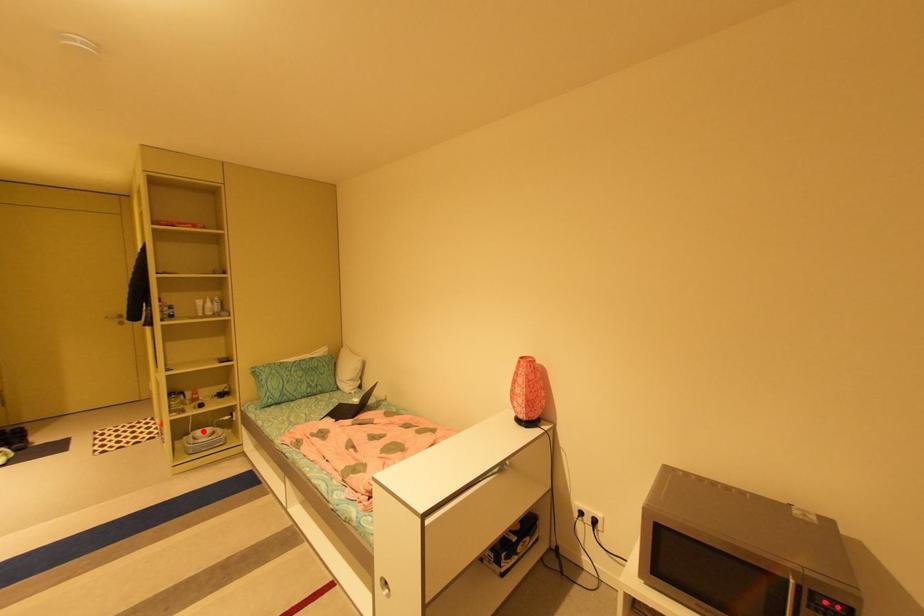
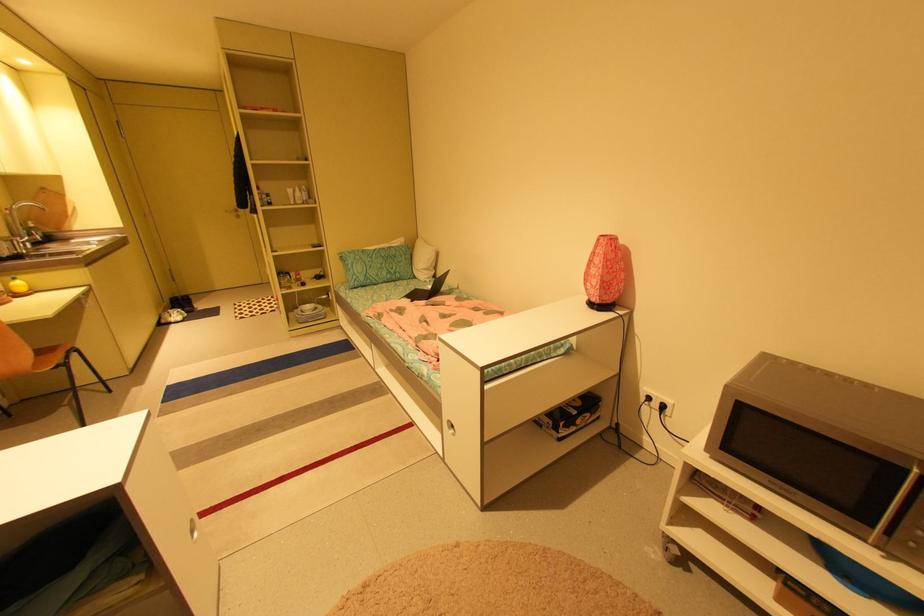
The point at the highlighted location is marked in the first image. Where is the corresponding point in the second image?

(310, 306)